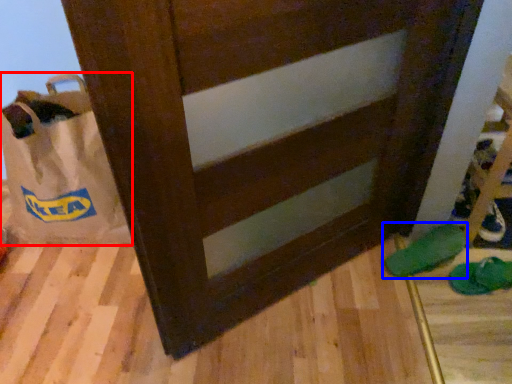
Question: Which object appears closest to the camera in this image, grocery bag (highlighted by a red box) or footwear (highlighted by a blue box)?

Choices:
 (A) grocery bag
 (B) footwear

Answer: (A)